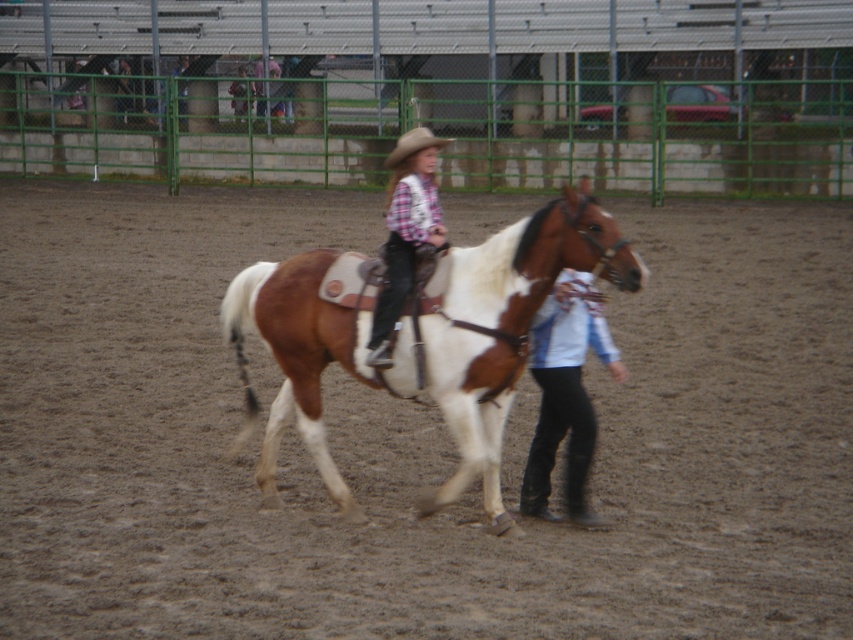
Does black leather pants at lower right have a greater width compared to matte brown cowboy hat at upper center?

Correct, the width of black leather pants at lower right exceeds that of matte brown cowboy hat at upper center.

Can you confirm if black leather pants at lower right is positioned to the left of matte brown cowboy hat at upper center?

Incorrect, black leather pants at lower right is not on the left side of matte brown cowboy hat at upper center.

Who is more forward, (x=595, y=337) or (x=247, y=92)?

Positioned in front is point (x=595, y=337).

Identify the location of black leather pants at lower right. This screenshot has width=853, height=640. (566, 392).

Does point (398, 310) come closer to viewer compared to point (229, 93)?

That is True.

Based on the photo, does plaid shirt and jeans at center come in front of matte brown cowboy hat at upper center?

That is True.

Locate an element on the screen. plaid shirt and jeans at center is located at coordinates (405, 232).

From the picture: Between black leather pants at lower right and plaid shirt and jeans at center, which one is positioned higher?

plaid shirt and jeans at center is above.

Is black leather pants at lower right above plaid shirt and jeans at center?

No.

Which is in front, point (552, 312) or point (405, 234)?

Point (405, 234)

You are a GUI agent. You are given a task and a screenshot of the screen. Output one action in this format:
    pyautogui.click(x=<x>, y=<y>)
    Task: Click on the black leather pants at lower right
    
    Given the screenshot: What is the action you would take?
    pyautogui.click(x=566, y=392)